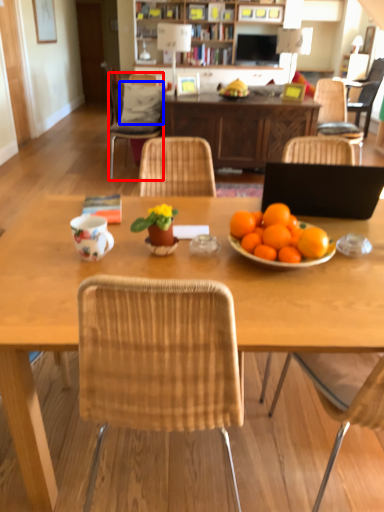
Question: Which object appears closest to the camera in this image, chair (highlighted by a red box) or pillow (highlighted by a blue box)?

Choices:
 (A) chair
 (B) pillow

Answer: (A)